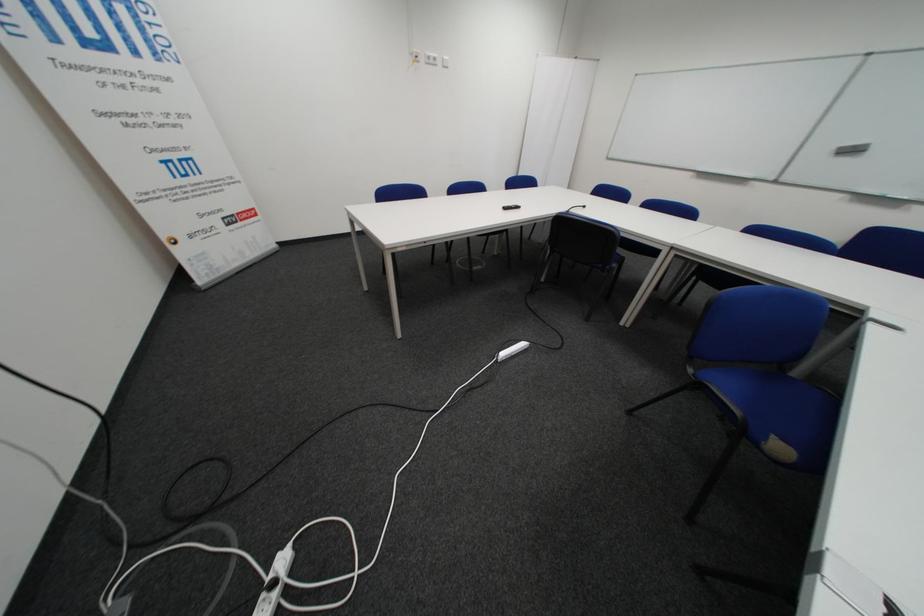
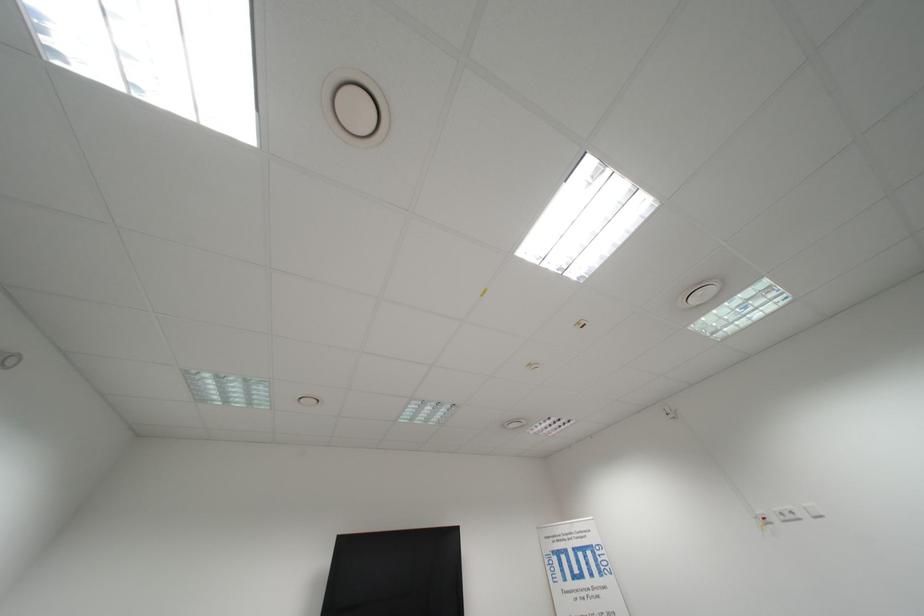
Where in the second image is the point corresponding to (x=455, y=60) from the first image?

(818, 509)